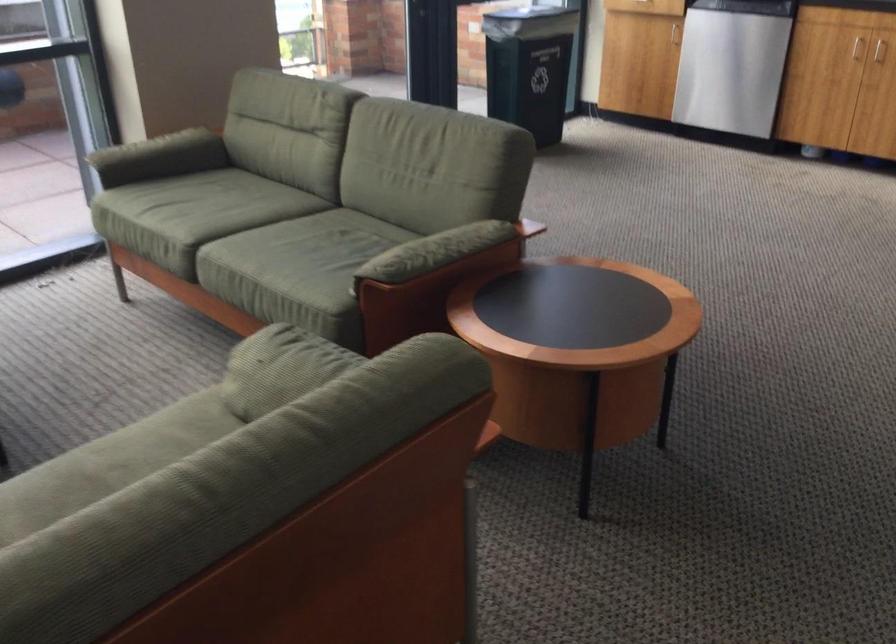
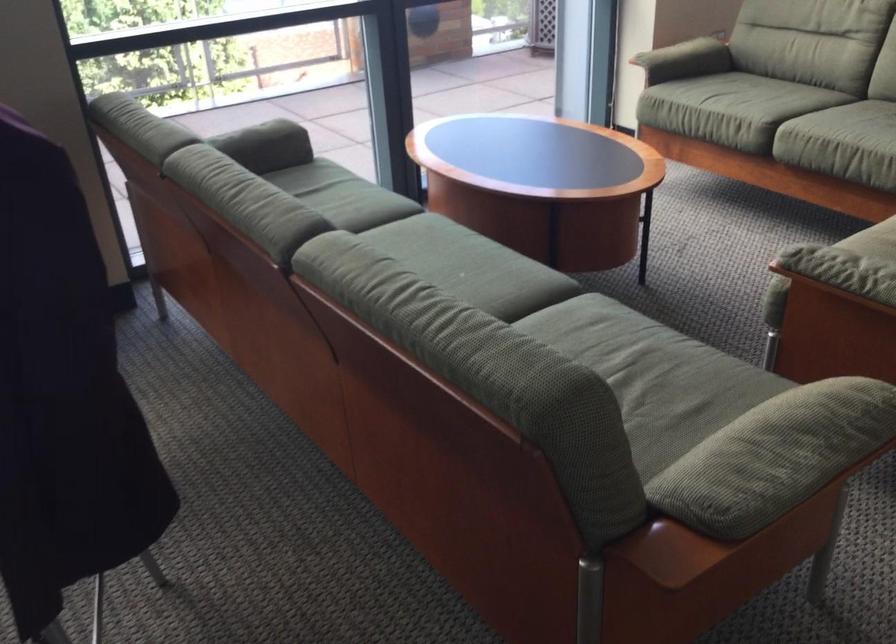
Locate, in the second image, the point that corresponds to pixel 168 240 in the first image.

(751, 111)